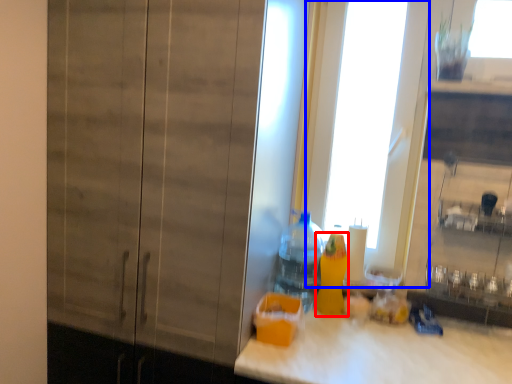
Question: Which object appears closest to the camera in this image, bottle (highlighted by a red box) or glass door (highlighted by a blue box)?

Choices:
 (A) bottle
 (B) glass door

Answer: (A)